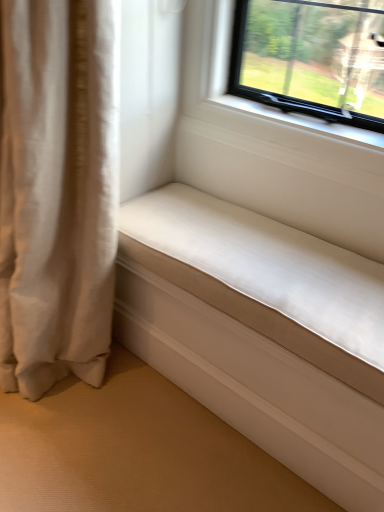
What is the approximate width of beige fabric curtain at left?

42.96 centimeters.

Identify the location of beige fabric curtain at left. Image resolution: width=384 pixels, height=512 pixels. (58, 190).

What do you see at coordinates (58, 190) in the screenshot? This screenshot has width=384, height=512. I see `beige fabric curtain at left` at bounding box center [58, 190].

Describe the element at coordinates (261, 332) in the screenshot. The height and width of the screenshot is (512, 384). I see `white smooth cushion at lower right` at that location.

Find the location of a particular element. The height and width of the screenshot is (512, 384). white smooth cushion at lower right is located at coordinates (261, 332).

I want to click on beige fabric curtain at left, so click(x=58, y=190).

Is white smooth cushion at lower right to the left or to the right of beige fabric curtain at left in the image?

Clearly, white smooth cushion at lower right is on the right of beige fabric curtain at left in the image.

In the image, is white smooth cushion at lower right positioned in front of or behind beige fabric curtain at left?

white smooth cushion at lower right is positioned farther from the viewer than beige fabric curtain at left.

From the picture: Which point is more distant from viewer, (329, 271) or (98, 244)?

The point (98, 244) is farther.

From the image's perspective, is white smooth cushion at lower right on beige fabric curtain at left?

No, from the image's perspective, white smooth cushion at lower right is not on top of beige fabric curtain at left.

From a real-world perspective, is white smooth cushion at lower right under beige fabric curtain at left?

Yes, from a real-world perspective, white smooth cushion at lower right is under beige fabric curtain at left.

Is white smooth cushion at lower right wider than beige fabric curtain at left?

No.

From their relative heights in the image, would you say white smooth cushion at lower right is taller or shorter than beige fabric curtain at left?

In the image, white smooth cushion at lower right appears to be shorter than beige fabric curtain at left.

Between white smooth cushion at lower right and beige fabric curtain at left, which one has larger size?

beige fabric curtain at left.

Is white smooth cushion at lower right spatially inside beige fabric curtain at left, or outside of it?

white smooth cushion at lower right is not enclosed by beige fabric curtain at left.

Is white smooth cushion at lower right directly adjacent to beige fabric curtain at left?

No, white smooth cushion at lower right is not making contact with beige fabric curtain at left.

Is white smooth cushion at lower right looking in the opposite direction of beige fabric curtain at left?

That's not correct — white smooth cushion at lower right is not looking away from beige fabric curtain at left.

Find the location of a particular element. studio couch below the beige fabric curtain at left (from the image's perspective) is located at coordinates [x=261, y=332].

From the picture: Is beige fabric curtain at left to the left or to the right of white smooth cushion at lower right in the image?

Clearly, beige fabric curtain at left is on the left of white smooth cushion at lower right in the image.

Is beige fabric curtain at left behind white smooth cushion at lower right?

No, beige fabric curtain at left is closer to the camera.

Which is less distant, (94, 365) or (143, 337)?

Point (94, 365) is positioned closer to the camera compared to point (143, 337).

From the image's perspective, does beige fabric curtain at left appear lower than white smooth cushion at lower right?

No, from the image's perspective, beige fabric curtain at left is not beneath white smooth cushion at lower right.

From a real-world perspective, which is physically below, beige fabric curtain at left or white smooth cushion at lower right?

From a 3D spatial view, white smooth cushion at lower right is below.

Which object is thinner, beige fabric curtain at left or white smooth cushion at lower right?

white smooth cushion at lower right is thinner.

Considering the relative sizes of beige fabric curtain at left and white smooth cushion at lower right in the image provided, is beige fabric curtain at left taller than white smooth cushion at lower right?

Yes, beige fabric curtain at left is taller than white smooth cushion at lower right.

Can you confirm if beige fabric curtain at left is bigger than white smooth cushion at lower right?

Correct, beige fabric curtain at left is larger in size than white smooth cushion at lower right.

Do you think beige fabric curtain at left is within white smooth cushion at lower right, or outside of it?

beige fabric curtain at left is spatially situated outside white smooth cushion at lower right.

Is beige fabric curtain at left not close to white smooth cushion at lower right?

That's not correct — beige fabric curtain at left is a little close to white smooth cushion at lower right.

Is beige fabric curtain at left oriented away from white smooth cushion at lower right?

beige fabric curtain at left does not have its back to white smooth cushion at lower right.

How many degrees apart are the facing directions of beige fabric curtain at left and white smooth cushion at lower right?

beige fabric curtain at left and white smooth cushion at lower right are facing 0.0955 degrees away from each other.

Locate an element on the screen. studio couch behind the beige fabric curtain at left is located at coordinates (261, 332).

Locate an element on the screen. studio couch below the beige fabric curtain at left (from the image's perspective) is located at coordinates (261, 332).

I want to click on studio couch behind the beige fabric curtain at left, so click(261, 332).